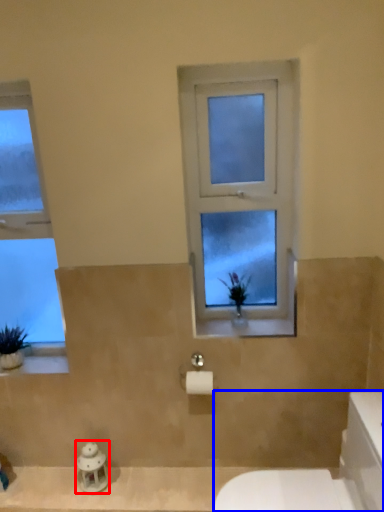
Question: Which object appears closest to the camera in this image, figurine (highlighted by a red box) or porcelain (highlighted by a blue box)?

Choices:
 (A) figurine
 (B) porcelain

Answer: (B)